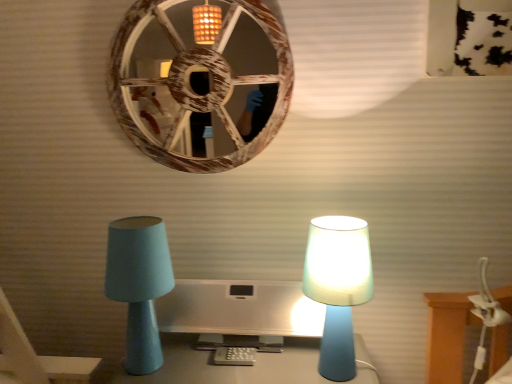
Question: Would you say satin silver monitor at center is part of matte blue lamp at right, the 1th lamp from the right,'s contents?

Choices:
 (A) yes
 (B) no

Answer: (B)

Question: Can we say matte blue lamp at right, the second lamp when ordered from left to right, lies outside satin silver monitor at center?

Choices:
 (A) no
 (B) yes

Answer: (B)

Question: From a real-world perspective, does matte blue lamp at right, the 1th lamp from the right, stand above satin silver monitor at center?

Choices:
 (A) no
 (B) yes

Answer: (B)

Question: Considering the relative positions of matte blue lamp at right, the 1th lamp from the right, and satin silver monitor at center in the image provided, is matte blue lamp at right, the 1th lamp from the right, to the right of satin silver monitor at center from the viewer's perspective?

Choices:
 (A) no
 (B) yes

Answer: (B)

Question: Considering the relative sizes of matte blue lamp at right, the second lamp when ordered from left to right, and satin silver monitor at center in the image provided, is matte blue lamp at right, the second lamp when ordered from left to right, taller than satin silver monitor at center?

Choices:
 (A) yes
 (B) no

Answer: (A)

Question: Considering the relative sizes of matte blue lamp at right, the 1th lamp from the right, and satin silver monitor at center in the image provided, is matte blue lamp at right, the 1th lamp from the right, bigger than satin silver monitor at center?

Choices:
 (A) no
 (B) yes

Answer: (A)

Question: Considering the relative positions of matte blue lamp at right, the second lamp when ordered from left to right, and wooden wheel at upper center in the image provided, is matte blue lamp at right, the second lamp when ordered from left to right, to the right of wooden wheel at upper center from the viewer's perspective?

Choices:
 (A) yes
 (B) no

Answer: (A)

Question: From the image's perspective, is matte blue lamp at right, the second lamp when ordered from left to right, below wooden wheel at upper center?

Choices:
 (A) yes
 (B) no

Answer: (A)

Question: Is matte blue lamp at right, the second lamp when ordered from left to right, bigger than wooden wheel at upper center?

Choices:
 (A) yes
 (B) no

Answer: (B)

Question: Is matte blue lamp at right, the second lamp when ordered from left to right, aimed at wooden wheel at upper center?

Choices:
 (A) yes
 (B) no

Answer: (B)

Question: Can wooden wheel at upper center be found inside matte blue lamp at right, the second lamp when ordered from left to right?

Choices:
 (A) no
 (B) yes

Answer: (A)

Question: Is matte blue lamp at right, the second lamp when ordered from left to right, smaller than wooden wheel at upper center?

Choices:
 (A) no
 (B) yes

Answer: (B)

Question: Considering the relative sizes of wooden wheel at upper center and matte blue lamp at left, the first lamp from the left, in the image provided, is wooden wheel at upper center bigger than matte blue lamp at left, the first lamp from the left,?

Choices:
 (A) no
 (B) yes

Answer: (B)